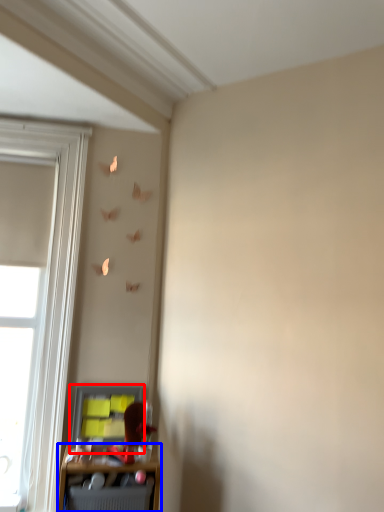
Question: Among these objects, which one is nearest to the camera, cabinet (highlighted by a red box) or shelf (highlighted by a blue box)?

Choices:
 (A) cabinet
 (B) shelf

Answer: (B)